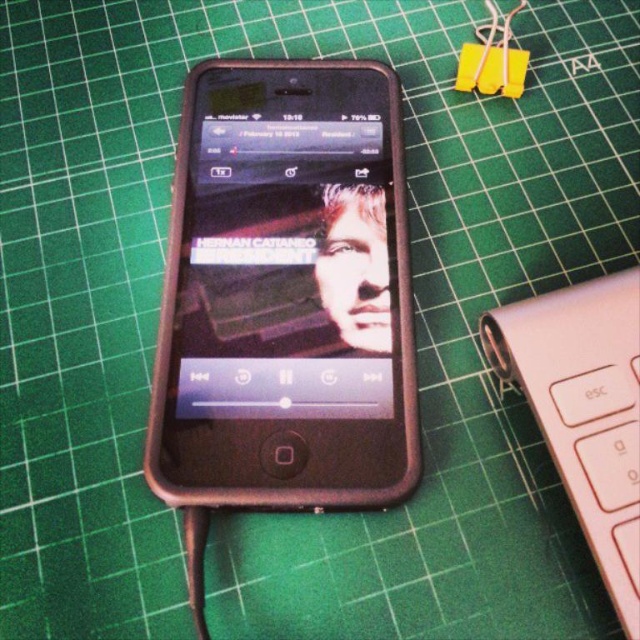
Can you confirm if black matte smartphone at center is positioned to the left of pink matte keyboard at lower right?

Correct, you'll find black matte smartphone at center to the left of pink matte keyboard at lower right.

Is point (205, 168) positioned before point (625, 557)?

No, (205, 168) is further to viewer.

I want to click on black matte smartphone at center, so click(285, 292).